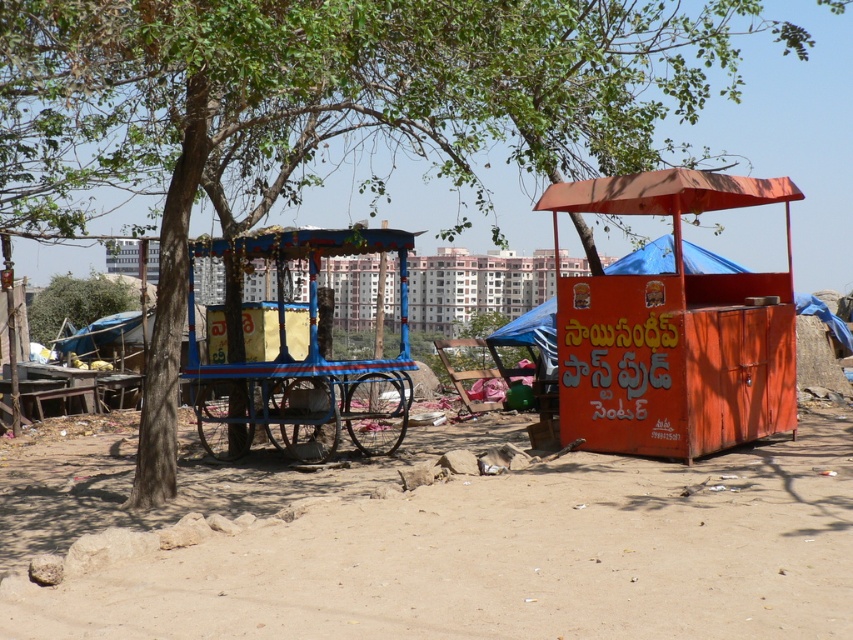
You are planning to set up a small tent in the outdoor scene. The dusty sand at lower center and the green leafy tree at center are in your path. Which location would provide a more stable base for the tent, and why?

The green leafy tree at center provides a more stable base for the tent because the dusty sand at lower center is thinner, making it less stable compared to the area around the tree.

You are standing in front of the blue painted wood cart at center and the blue fabric canopy at center. Which object is nearer to you?

The blue painted wood cart at center is closer to the viewer than the blue fabric canopy at center.

You are a customer looking to buy a drink. You see an orange painted cart at right and a blue fabric canopy at center. Which structure is taller where you can find a drink vendor?

The orange painted cart at right is taller than the blue fabric canopy at center. Therefore, the taller structure where you can find a drink vendor is the orange painted cart at right.